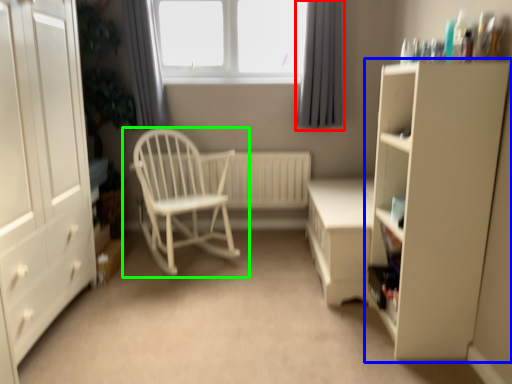
Question: Based on their relative distances, which object is farther from curtain (highlighted by a red box)? Choose from cupboard (highlighted by a blue box) and chair (highlighted by a green box).

Choices:
 (A) cupboard
 (B) chair

Answer: (A)